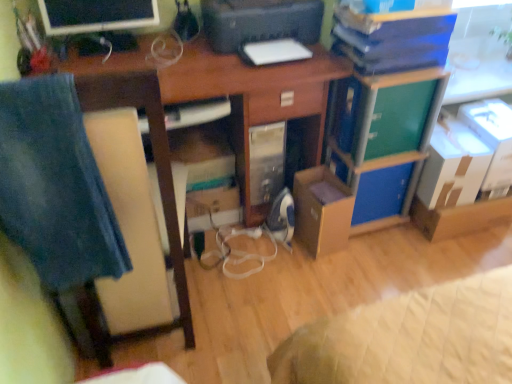
Question: Can you confirm if brown cardboard box at lower right, the second cardboard box viewed from the right, is bigger than blue cardboard box at center-right?

Choices:
 (A) yes
 (B) no

Answer: (A)

Question: Does brown cardboard box at lower right, the second cardboard box viewed from the right, turn towards blue cardboard box at center-right?

Choices:
 (A) yes
 (B) no

Answer: (B)

Question: From the image's perspective, would you say brown cardboard box at lower right, the second cardboard box viewed from the right, is shown under blue cardboard box at center-right?

Choices:
 (A) yes
 (B) no

Answer: (A)

Question: From the image's perspective, would you say brown cardboard box at lower right, the second cardboard box viewed from the right, is positioned over blue cardboard box at center-right?

Choices:
 (A) yes
 (B) no

Answer: (B)

Question: Considering the relative positions of brown cardboard box at lower right, which is the 3th cardboard box in left-to-right order, and blue cardboard box at center-right in the image provided, is brown cardboard box at lower right, which is the 3th cardboard box in left-to-right order, behind blue cardboard box at center-right?

Choices:
 (A) yes
 (B) no

Answer: (A)

Question: Can you confirm if brown cardboard box at lower right, the second cardboard box viewed from the right, is smaller than blue cardboard box at center-right?

Choices:
 (A) no
 (B) yes

Answer: (A)

Question: Is wooden chair at left positioned with its back to brown cardboard box at center, which appears as the 4th cardboard box when viewed from the right?

Choices:
 (A) yes
 (B) no

Answer: (B)

Question: From the image's perspective, would you say wooden chair at left is positioned over brown cardboard box at center, arranged as the 1th cardboard box when viewed from the left?

Choices:
 (A) no
 (B) yes

Answer: (B)

Question: Is wooden chair at left with brown cardboard box at center, arranged as the 1th cardboard box when viewed from the left?

Choices:
 (A) yes
 (B) no

Answer: (B)

Question: Is brown cardboard box at center, arranged as the 1th cardboard box when viewed from the left, a part of wooden chair at left?

Choices:
 (A) yes
 (B) no

Answer: (B)

Question: Does wooden chair at left have a greater width compared to brown cardboard box at center, which appears as the 4th cardboard box when viewed from the right?

Choices:
 (A) no
 (B) yes

Answer: (B)

Question: Is wooden chair at left at the left side of brown cardboard box at center, arranged as the 1th cardboard box when viewed from the left?

Choices:
 (A) yes
 (B) no

Answer: (A)

Question: Considering the relative sizes of blue cardboard box at center-right and black plastic printer at upper center in the image provided, is blue cardboard box at center-right wider than black plastic printer at upper center?

Choices:
 (A) yes
 (B) no

Answer: (B)